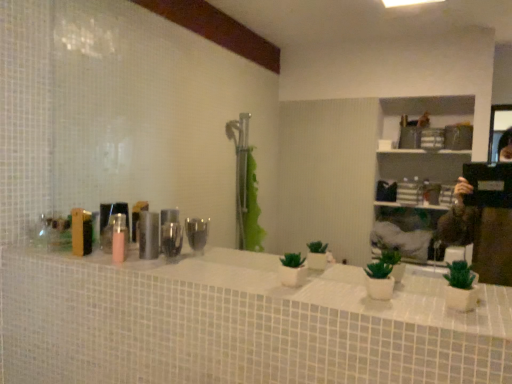
Locate an element on the screen. The image size is (512, 384). vacant area on top of white glossy counter top at center (from a real-world perspective) is located at coordinates (238, 270).